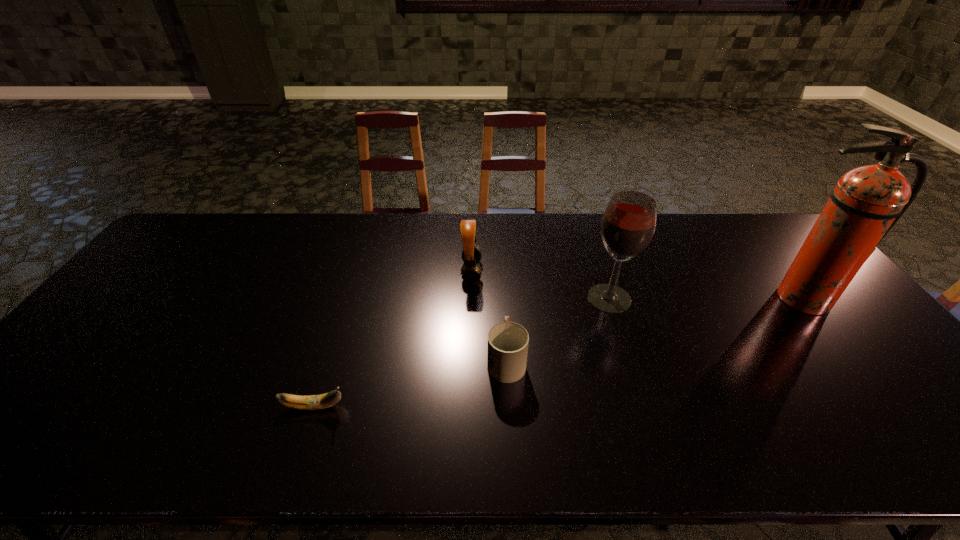
Where is `vacant region at the left edge of the desktop`? The height and width of the screenshot is (540, 960). vacant region at the left edge of the desktop is located at coordinates (92, 340).

This screenshot has width=960, height=540. Identify the location of vacant space at the far right corner. (762, 241).

This screenshot has width=960, height=540. Find the location of `free space between the leftmost object and the fourth tallest object`. free space between the leftmost object and the fourth tallest object is located at coordinates (410, 383).

I want to click on free point between the rightmost object and the third tallest object, so click(x=636, y=285).

Identify the location of free space between the second object from right to left and the rightmost object. The width and height of the screenshot is (960, 540). (705, 299).

The height and width of the screenshot is (540, 960). In order to click on free space between the nearest object and the second nearest object in this screenshot , I will do `click(410, 383)`.

This screenshot has width=960, height=540. Find the location of `free space that is in between the alcohol and the tallest object`. free space that is in between the alcohol and the tallest object is located at coordinates (705, 299).

In order to click on empty space between the second nearest object and the rightmost object in this screenshot , I will do `click(654, 329)`.

Find the location of a particular element. The width and height of the screenshot is (960, 540). free space between the nearest object and the fourth farthest object is located at coordinates (410, 383).

What are the coordinates of `empty space that is in between the nearest object and the tallest object` in the screenshot? It's located at (557, 353).